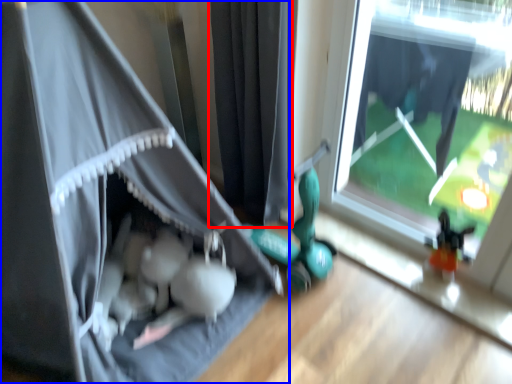
Question: Which of the following is the closest to the observer, curtain (highlighted by a red box) or curtain (highlighted by a blue box)?

Choices:
 (A) curtain
 (B) curtain

Answer: (B)